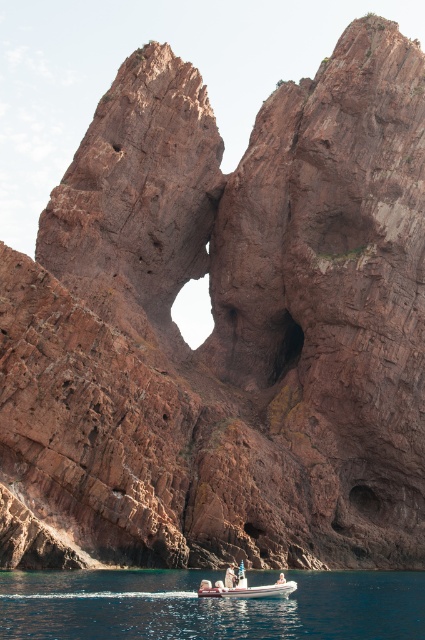
Can you confirm if clear blue water at lower center is positioned to the left of rubber dinghy at center?

No, clear blue water at lower center is not to the left of rubber dinghy at center.

Can you confirm if clear blue water at lower center is thinner than rubber dinghy at center?

No.

Who is more forward, [320,637] or [257,589]?

Positioned in front is point [320,637].

What are the coordinates of `clear blue water at lower center` in the screenshot? It's located at (207, 605).

Between clear blue water at lower center and light brown wooden paddle at center, which one has less height?

With less height is light brown wooden paddle at center.

Where is `clear blue water at lower center`? The image size is (425, 640). clear blue water at lower center is located at coordinates (207, 605).

Locate an element on the screen. clear blue water at lower center is located at coordinates (207, 605).

Is rubber dinghy at center positioned behind light brown wooden paddle at center?

That is False.

Is rubber dinghy at center to the left of light brown wooden paddle at center from the viewer's perspective?

Incorrect, rubber dinghy at center is not on the left side of light brown wooden paddle at center.

Which is behind, point (241, 586) or point (232, 572)?

The point (232, 572) is more distant.

Image resolution: width=425 pixels, height=640 pixels. Identify the location of rubber dinghy at center. (244, 586).